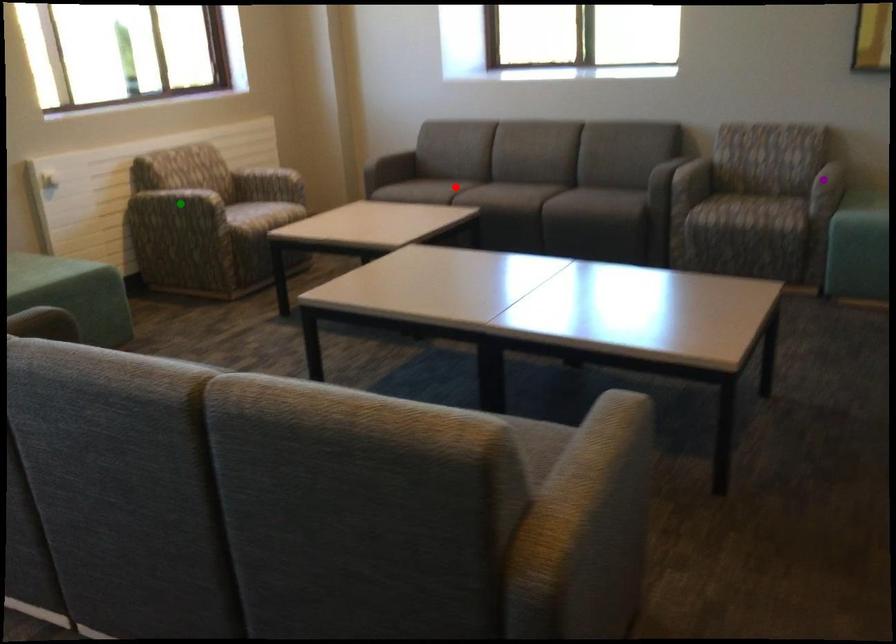
Order these from nearest to farthest:
1. green point
2. purple point
3. red point

purple point → green point → red point